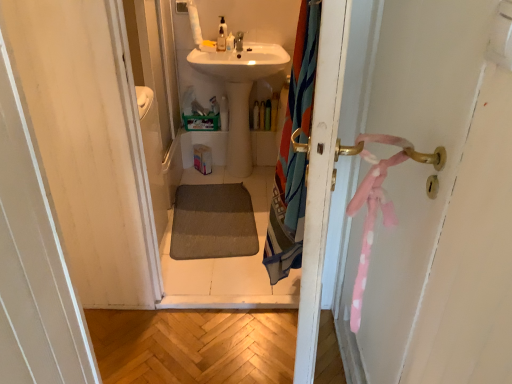
Question: Is translucent plastic soap dispenser at upper center, the 1th toiletry positioned from the top, inside or outside of white glossy sink at center?

Choices:
 (A) outside
 (B) inside

Answer: (A)

Question: Does point (228, 41) appear closer or farther from the camera than point (236, 54)?

Choices:
 (A) closer
 (B) farther

Answer: (B)

Question: Estimate the real-world distances between objects in this image. Which object is closer to the translucent plastic soap dispenser at upper center, which appears as the third toiletry when ordered from the bottom?

Choices:
 (A) multicolored fabric shower curtain at right
 (B) translucent plastic bottle at center, which is counted as the 4th toiletry, starting from the left
 (C) translucent plastic bottle at center, placed as the 2th toiletry when sorted from back to front
 (D) matte white faucet at upper center
 (E) white glossy sink at center

Answer: (D)

Question: Estimate the real-world distances between objects in this image. Which object is closer to the matte white faucet at upper center?

Choices:
 (A) translucent plastic soap dispenser at upper center, which appears as the third toiletry when ordered from the bottom
 (B) translucent plastic bottle at center, positioned as the first toiletry in bottom-to-top order
 (C) translucent plastic bottle at center, which is counted as the 4th toiletry, starting from the left
 (D) multicolored fabric shower curtain at right
 (E) white glossy sink at center

Answer: (A)